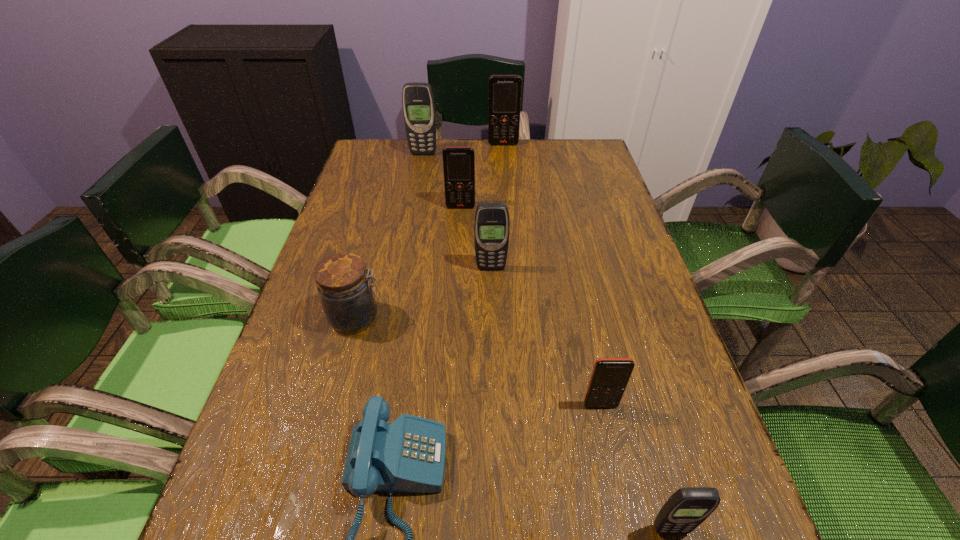
Locate an element on the screen. Image resolution: width=960 pixels, height=540 pixels. the second closest gray cellular telephone relative to the farthest gray cellular telephone is located at coordinates (687, 508).